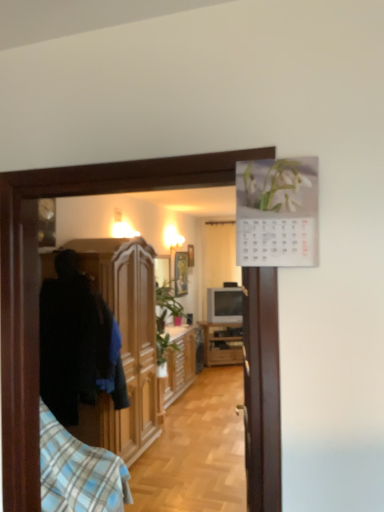
Question: Is white sheer curtain at center facing towards wooden picture frame at center?

Choices:
 (A) no
 (B) yes

Answer: (B)

Question: From the image's perspective, is white sheer curtain at center under wooden picture frame at center?

Choices:
 (A) no
 (B) yes

Answer: (A)

Question: Considering the relative sizes of white sheer curtain at center and wooden picture frame at center in the image provided, is white sheer curtain at center bigger than wooden picture frame at center?

Choices:
 (A) no
 (B) yes

Answer: (B)

Question: Can you confirm if white sheer curtain at center is thinner than wooden picture frame at center?

Choices:
 (A) no
 (B) yes

Answer: (A)

Question: Considering the relative sizes of white sheer curtain at center and wooden picture frame at center in the image provided, is white sheer curtain at center wider than wooden picture frame at center?

Choices:
 (A) no
 (B) yes

Answer: (B)

Question: Is white sheer curtain at center to the right of wooden picture frame at center from the viewer's perspective?

Choices:
 (A) no
 (B) yes

Answer: (B)

Question: Could wooden cabinet at center, which is the second cabinetry from back to front, be considered to be inside white sheer curtain at center?

Choices:
 (A) yes
 (B) no

Answer: (B)

Question: Would you consider white sheer curtain at center to be distant from wooden cabinet at center, the 2th cabinetry in the front-to-back sequence?

Choices:
 (A) yes
 (B) no

Answer: (A)

Question: Is white sheer curtain at center oriented away from wooden cabinet at center, the 2th cabinetry in the front-to-back sequence?

Choices:
 (A) no
 (B) yes

Answer: (A)

Question: Could you tell me if white sheer curtain at center is turned towards wooden cabinet at center, which is the second cabinetry from back to front?

Choices:
 (A) yes
 (B) no

Answer: (A)

Question: Can we say white sheer curtain at center lies outside wooden cabinet at center, which is the second cabinetry from back to front?

Choices:
 (A) yes
 (B) no

Answer: (A)

Question: Is white sheer curtain at center further to the viewer compared to wooden cabinet at center, the 2th cabinetry in the front-to-back sequence?

Choices:
 (A) yes
 (B) no

Answer: (A)

Question: Is blue plaid shirt at left to the right of wooden picture frame at center from the viewer's perspective?

Choices:
 (A) no
 (B) yes

Answer: (A)